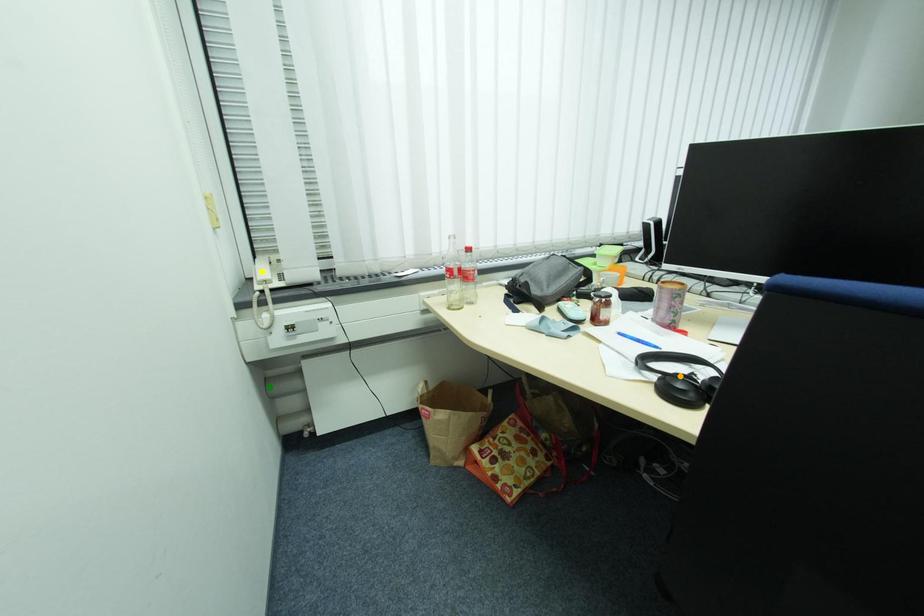
Order these from nearest to farthest:
yellow point | orange point | green point

green point, yellow point, orange point